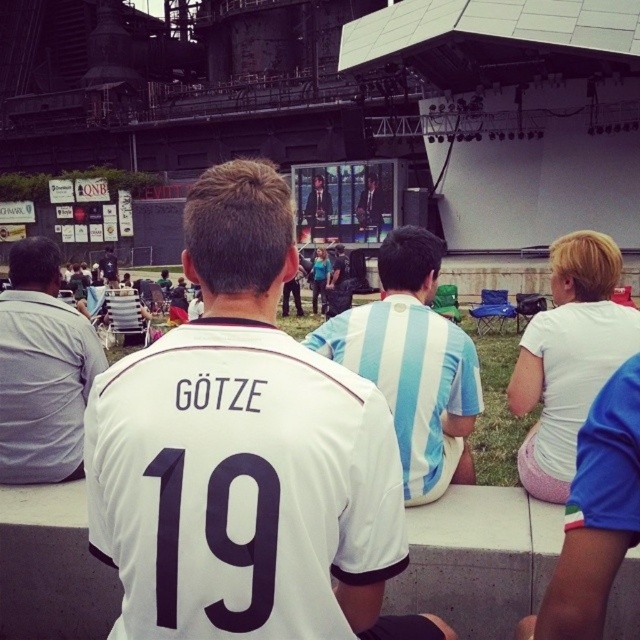
Does white jersey at center have a lesser width compared to white striped jersey at center?

No.

Between white jersey at center and white striped jersey at center, which one is positioned lower?

white jersey at center

Which is in front, point (304, 611) or point (310, 348)?

Point (304, 611)

Locate an element on the screen. This screenshot has height=640, width=640. white jersey at center is located at coordinates (244, 454).

Is white jersey at center shorter than white matte shorts at lower right?

Incorrect, white jersey at center's height does not fall short of white matte shorts at lower right's.

Who is shorter, white jersey at center or white matte shorts at lower right?

With less height is white matte shorts at lower right.

Is point (241, 358) less distant than point (564, 572)?

Yes, it is in front of point (564, 572).

Find the location of a particular element. white jersey at center is located at coordinates (244, 454).

Which is behind, point (378, 364) or point (28, 413)?

Point (28, 413)

Measure the distance between white striped jersey at center and camera.

43.70 feet

Where is `white striped jersey at center`? This screenshot has width=640, height=640. white striped jersey at center is located at coordinates (412, 364).